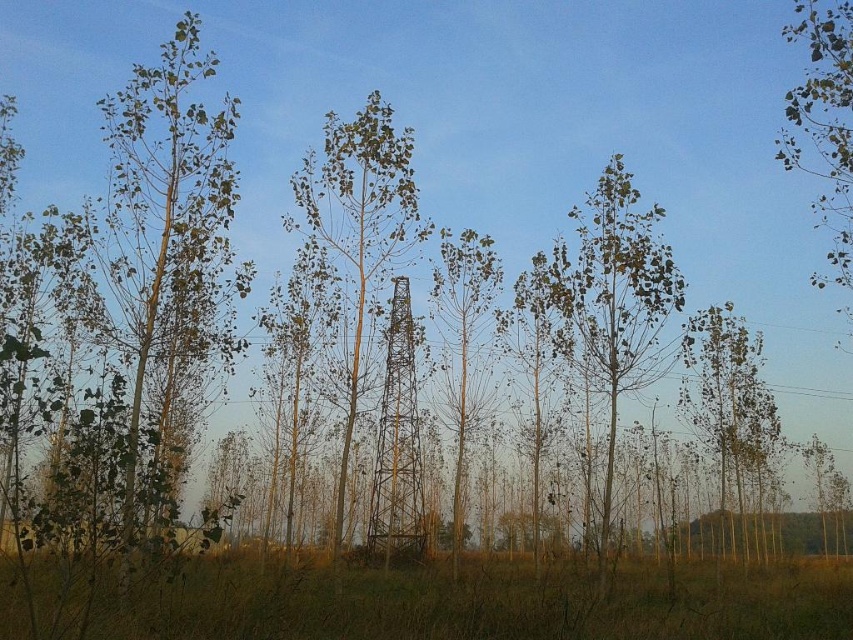
You are a park ranger planning to install a new bench between the green matte tree at upper right and the green leafy tree at center. The bench requires a minimum of 10 meters of space between the two trees to be placed safely. Based on the distance provided, can the bench be installed there?

The green matte tree at upper right is 10.81 meters away from the green leafy tree at center. Since the required minimum distance is 10 meters, the bench can be safely installed between them as the distance meets the requirement.

You are a gardener standing at the base of the green leafy tree at center. You want to water the green matte tree at upper right. Which direction should you walk to reach it?

The green matte tree at upper right is to the right of the green leafy tree at center, so you should walk to the right to reach it.

You are standing at the edge of the field looking towards the utility tower. You see the brown grass at lower center and the green leafy tree at center. Which object is positioned to the right of the other?

The brown grass at lower center is to the right of the green leafy tree at center according to the description.